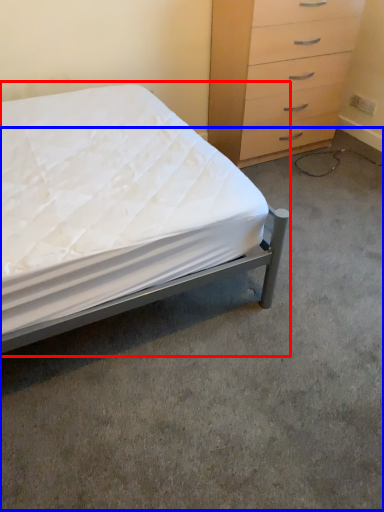
Question: Which point is closer to the camera, bed (highlighted by a red box) or concrete (highlighted by a blue box)?

Choices:
 (A) bed
 (B) concrete

Answer: (A)